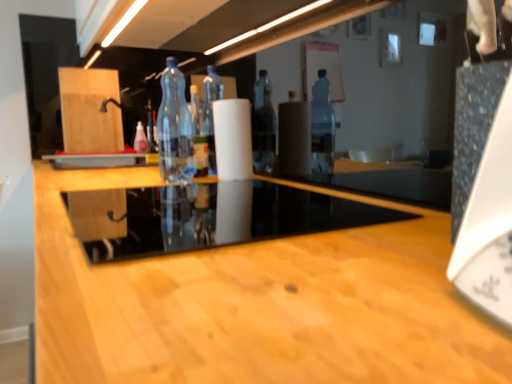
Find the location of a particular element. This screenshot has height=384, width=512. transparent plastic bottle at center, placed as the second bottle when sorted from left to right is located at coordinates (175, 127).

The height and width of the screenshot is (384, 512). What do you see at coordinates (233, 139) in the screenshot?
I see `white matte paper towel at center` at bounding box center [233, 139].

Locate an element on the screen. The image size is (512, 384). transparent plastic bottle at center, the 1th bottle when ordered from right to left is located at coordinates (175, 127).

Does white matte paper towel at center have a lesser height compared to transparent plastic bottle at center, placed as the second bottle when sorted from left to right?

Yes, white matte paper towel at center is shorter than transparent plastic bottle at center, placed as the second bottle when sorted from left to right.

Is white matte paper towel at center looking in the opposite direction of transparent plastic bottle at center, which appears as the 1th bottle when viewed from the front?

No, transparent plastic bottle at center, which appears as the 1th bottle when viewed from the front, is not at the back of white matte paper towel at center.

From the image's perspective, would you say white matte paper towel at center is positioned over transparent plastic bottle at center, which ranks as the 2th bottle in back-to-front order?

No, from the image's perspective, white matte paper towel at center is not over transparent plastic bottle at center, which ranks as the 2th bottle in back-to-front order.

Is pink plastic bottle at center, marked as the 2th bottle in a right-to-left arrangement, looking in the opposite direction of transparent plastic bottle at center, which ranks as the 2th bottle in back-to-front order?

pink plastic bottle at center, marked as the 2th bottle in a right-to-left arrangement, does not have its back to transparent plastic bottle at center, which ranks as the 2th bottle in back-to-front order.

In the scene shown: From a real-world perspective, is pink plastic bottle at center, which is the second bottle from front to back, on transparent plastic bottle at center, which appears as the 1th bottle when viewed from the front?

Actually, pink plastic bottle at center, which is the second bottle from front to back, is physically below transparent plastic bottle at center, which appears as the 1th bottle when viewed from the front, in the real world.

Looking at this image, can you tell me how much pink plastic bottle at center, the first bottle from the back, and transparent plastic bottle at center, the 1th bottle when ordered from right to left, differ in facing direction?

28.8 degrees separate the facing orientations of pink plastic bottle at center, the first bottle from the back, and transparent plastic bottle at center, the 1th bottle when ordered from right to left.

Considering the sizes of pink plastic bottle at center, marked as the 2th bottle in a right-to-left arrangement, and transparent glass table at center in the image, is pink plastic bottle at center, marked as the 2th bottle in a right-to-left arrangement, bigger or smaller than transparent glass table at center?

pink plastic bottle at center, marked as the 2th bottle in a right-to-left arrangement, is smaller than transparent glass table at center.

Considering the sizes of objects pink plastic bottle at center, which is the second bottle from front to back, and transparent glass table at center in the image provided, who is thinner, pink plastic bottle at center, which is the second bottle from front to back, or transparent glass table at center?

With smaller width is pink plastic bottle at center, which is the second bottle from front to back.

In the scene shown: Does pink plastic bottle at center, which is the second bottle from front to back, have a lesser height compared to transparent glass table at center?

No.

Based on the photo, are pink plastic bottle at center, the first bottle from the left, and transparent glass table at center beside each other?

No, pink plastic bottle at center, the first bottle from the left, is not beside transparent glass table at center.

Considering the positions of points (186, 104) and (141, 123), is point (186, 104) farther from camera compared to point (141, 123)?

No.

From the image's perspective, does transparent plastic bottle at center, which ranks as the 2th bottle in back-to-front order, appear higher than pink plastic bottle at center, marked as the 2th bottle in a right-to-left arrangement?

No.

Does transparent plastic bottle at center, which appears as the 1th bottle when viewed from the front, have a larger size compared to pink plastic bottle at center, which is the second bottle from front to back?

Yes.

Which of these two, transparent plastic bottle at center, which appears as the 1th bottle when viewed from the front, or pink plastic bottle at center, which is the second bottle from front to back, is thinner?

With smaller width is pink plastic bottle at center, which is the second bottle from front to back.

Which of these two, transparent plastic bottle at center, the 1th bottle when ordered from right to left, or transparent glass table at center, is smaller?

With smaller size is transparent plastic bottle at center, the 1th bottle when ordered from right to left.

From the image's perspective, which one is positioned lower, transparent plastic bottle at center, the 1th bottle when ordered from right to left, or transparent glass table at center?

From the image's view, transparent glass table at center is below.

Between transparent plastic bottle at center, which ranks as the 2th bottle in back-to-front order, and transparent glass table at center, which one has less height?

transparent glass table at center is shorter.

Does transparent plastic bottle at center, the 1th bottle when ordered from right to left, come behind transparent glass table at center?

Yes, the depth of transparent plastic bottle at center, the 1th bottle when ordered from right to left, is greater than that of transparent glass table at center.

Which is more to the right, white matte paper towel at center or pink plastic bottle at center, which is the second bottle from front to back?

Positioned to the right is white matte paper towel at center.

Is white matte paper towel at center outside of pink plastic bottle at center, which is the second bottle from front to back?

Yes, white matte paper towel at center is not within pink plastic bottle at center, which is the second bottle from front to back.

Between white matte paper towel at center and pink plastic bottle at center, the first bottle from the back, which one has smaller size?

With smaller size is pink plastic bottle at center, the first bottle from the back.

Does point (232, 165) come in front of point (141, 148)?

Yes, point (232, 165) is closer to viewer.

From the image's perspective, between pink plastic bottle at center, which is the second bottle from front to back, and white matte paper towel at center, who is located below?

white matte paper towel at center, from the image's perspective.

What's the angular difference between pink plastic bottle at center, the first bottle from the back, and white matte paper towel at center's facing directions?

The facing directions of pink plastic bottle at center, the first bottle from the back, and white matte paper towel at center are 28.8 degrees apart.

Is point (141, 138) behind point (223, 132)?

That is True.

Is pink plastic bottle at center, which is the second bottle from front to back, turned away from white matte paper towel at center?

That's not correct — pink plastic bottle at center, which is the second bottle from front to back, is not looking away from white matte paper towel at center.

Image resolution: width=512 pixels, height=384 pixels. What are the coordinates of `paper towel behind the transparent plastic bottle at center, which ranks as the 2th bottle in back-to-front order` in the screenshot? It's located at point(233,139).

Where is `bottle lying on the left of transparent plastic bottle at center, the 1th bottle when ordered from right to left`? bottle lying on the left of transparent plastic bottle at center, the 1th bottle when ordered from right to left is located at coordinates (140, 139).

Based on their spatial positions, is transparent plastic bottle at center, which ranks as the 2th bottle in back-to-front order, or white matte paper towel at center closer to transparent glass table at center?

white matte paper towel at center.

Looking at the image, which one is located further to transparent plastic bottle at center, the 1th bottle when ordered from right to left, white matte paper towel at center or transparent glass table at center?

transparent glass table at center is further to transparent plastic bottle at center, the 1th bottle when ordered from right to left.

When comparing their distances from transparent glass table at center, does pink plastic bottle at center, the first bottle from the back, or white matte paper towel at center seem further?

pink plastic bottle at center, the first bottle from the back.

Which object lies further to the anchor point transparent plastic bottle at center, which ranks as the 2th bottle in back-to-front order, white matte paper towel at center or pink plastic bottle at center, the first bottle from the left?

pink plastic bottle at center, the first bottle from the left.

Based on their spatial positions, is transparent glass table at center or white matte paper towel at center closer to transparent plastic bottle at center, which appears as the 1th bottle when viewed from the front?

The object closer to transparent plastic bottle at center, which appears as the 1th bottle when viewed from the front, is white matte paper towel at center.

Which object lies nearer to the anchor point pink plastic bottle at center, the first bottle from the back, transparent glass table at center or white matte paper towel at center?

The object closer to pink plastic bottle at center, the first bottle from the back, is white matte paper towel at center.

From the image, which object appears to be nearer to transparent plastic bottle at center, placed as the second bottle when sorted from left to right, pink plastic bottle at center, the first bottle from the left, or white matte paper towel at center?

The object closer to transparent plastic bottle at center, placed as the second bottle when sorted from left to right, is white matte paper towel at center.

When comparing their distances from transparent glass table at center, does pink plastic bottle at center, which is the second bottle from front to back, or transparent plastic bottle at center, the 1th bottle when ordered from right to left, seem closer?

transparent plastic bottle at center, the 1th bottle when ordered from right to left, is positioned closer to the anchor transparent glass table at center.

You are a GUI agent. You are given a task and a screenshot of the screen. Output one action in this format:
    pyautogui.click(x=<x>, y=<y>)
    Task: Click on the bottle between transparent glass table at center and pink plastic bottle at center, marked as the 2th bottle in a right-to-left arrangement, in the front-back direction
    The image size is (512, 384).
    Given the screenshot: What is the action you would take?
    pyautogui.click(x=175, y=127)

In order to click on paper towel between transparent plastic bottle at center, which ranks as the 2th bottle in back-to-front order, and pink plastic bottle at center, the first bottle from the back, from front to back in this screenshot , I will do `click(233, 139)`.

Image resolution: width=512 pixels, height=384 pixels. In order to click on bottle between transparent glass table at center and white matte paper towel at center along the z-axis in this screenshot , I will do `click(175, 127)`.

This screenshot has width=512, height=384. What are the coordinates of `paper towel between transparent glass table at center and pink plastic bottle at center, the first bottle from the back, along the z-axis` in the screenshot? It's located at (233, 139).